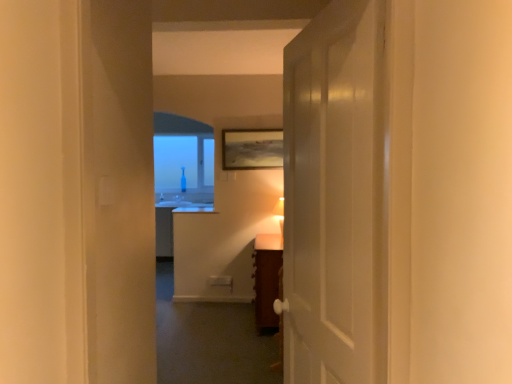
Question: Considering the relative sizes of brown wooden vanity at center and matte white table lamp at center in the image provided, is brown wooden vanity at center wider than matte white table lamp at center?

Choices:
 (A) no
 (B) yes

Answer: (B)

Question: From a real-world perspective, is brown wooden vanity at center positioned over matte white table lamp at center based on gravity?

Choices:
 (A) no
 (B) yes

Answer: (A)

Question: Would you consider brown wooden vanity at center to be distant from matte white table lamp at center?

Choices:
 (A) yes
 (B) no

Answer: (B)

Question: Is brown wooden vanity at center positioned in front of matte white table lamp at center?

Choices:
 (A) yes
 (B) no

Answer: (A)

Question: Is brown wooden vanity at center outside of matte white table lamp at center?

Choices:
 (A) yes
 (B) no

Answer: (A)

Question: Does brown wooden vanity at center have a larger size compared to matte white table lamp at center?

Choices:
 (A) yes
 (B) no

Answer: (A)

Question: Is brown wooden vanity at center facing away from white glossy door at center?

Choices:
 (A) yes
 (B) no

Answer: (B)

Question: Can you confirm if brown wooden vanity at center is wider than white glossy door at center?

Choices:
 (A) no
 (B) yes

Answer: (B)

Question: Is brown wooden vanity at center in front of white glossy door at center?

Choices:
 (A) yes
 (B) no

Answer: (B)

Question: From the image's perspective, is brown wooden vanity at center on white glossy door at center?

Choices:
 (A) no
 (B) yes

Answer: (A)

Question: Is brown wooden vanity at center with white glossy door at center?

Choices:
 (A) yes
 (B) no

Answer: (B)

Question: From a real-world perspective, is brown wooden vanity at center located beneath white glossy door at center?

Choices:
 (A) no
 (B) yes

Answer: (B)

Question: Does matte white table lamp at center appear on the right side of matte wooden picture frame at upper center?

Choices:
 (A) yes
 (B) no

Answer: (A)